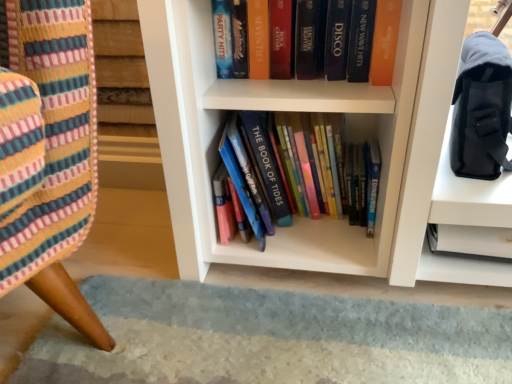
Question: Does orange matte book at upper center, acting as the 2th book starting from the bottom, lie behind hardcover books at center, which is the 1th book in bottom-to-top order?

Choices:
 (A) yes
 (B) no

Answer: (A)

Question: Considering the relative sizes of orange matte book at upper center, which is counted as the first book, starting from the top, and hardcover books at center, the second book in the top-to-bottom sequence, in the image provided, is orange matte book at upper center, which is counted as the first book, starting from the top, taller than hardcover books at center, the second book in the top-to-bottom sequence,?

Choices:
 (A) no
 (B) yes

Answer: (A)

Question: Can you confirm if orange matte book at upper center, acting as the 2th book starting from the bottom, is shorter than hardcover books at center, which is the 1th book in bottom-to-top order?

Choices:
 (A) yes
 (B) no

Answer: (A)

Question: Is orange matte book at upper center, which is counted as the first book, starting from the top, smaller than hardcover books at center, which is the 1th book in bottom-to-top order?

Choices:
 (A) no
 (B) yes

Answer: (B)

Question: Could you tell me if orange matte book at upper center, acting as the 2th book starting from the bottom, is turned towards hardcover books at center, which is the 1th book in bottom-to-top order?

Choices:
 (A) no
 (B) yes

Answer: (A)

Question: Is orange matte book at upper center, acting as the 2th book starting from the bottom, with hardcover books at center, the second book in the top-to-bottom sequence?

Choices:
 (A) no
 (B) yes

Answer: (A)

Question: Does hardcover books at center, the second book in the top-to-bottom sequence, have a greater height compared to orange matte book at upper center, acting as the 2th book starting from the bottom?

Choices:
 (A) no
 (B) yes

Answer: (B)

Question: Is orange matte book at upper center, acting as the 2th book starting from the bottom, a part of hardcover books at center, the second book in the top-to-bottom sequence?

Choices:
 (A) no
 (B) yes

Answer: (A)

Question: Is hardcover books at center, which is the 1th book in bottom-to-top order, at the right side of orange matte book at upper center, acting as the 2th book starting from the bottom?

Choices:
 (A) no
 (B) yes

Answer: (B)

Question: Is hardcover books at center, which is the 1th book in bottom-to-top order, completely or partially outside of orange matte book at upper center, which is counted as the first book, starting from the top?

Choices:
 (A) no
 (B) yes

Answer: (B)

Question: Does hardcover books at center, the second book in the top-to-bottom sequence, have a lesser width compared to orange matte book at upper center, acting as the 2th book starting from the bottom?

Choices:
 (A) no
 (B) yes

Answer: (A)

Question: Can you confirm if hardcover books at center, which is the 1th book in bottom-to-top order, is bigger than orange matte book at upper center, acting as the 2th book starting from the bottom?

Choices:
 (A) no
 (B) yes

Answer: (B)

Question: Considering the relative sizes of orange matte book at upper center, acting as the 2th book starting from the bottom, and black fabric shoulder bag at upper right in the image provided, is orange matte book at upper center, acting as the 2th book starting from the bottom, smaller than black fabric shoulder bag at upper right?

Choices:
 (A) no
 (B) yes

Answer: (B)